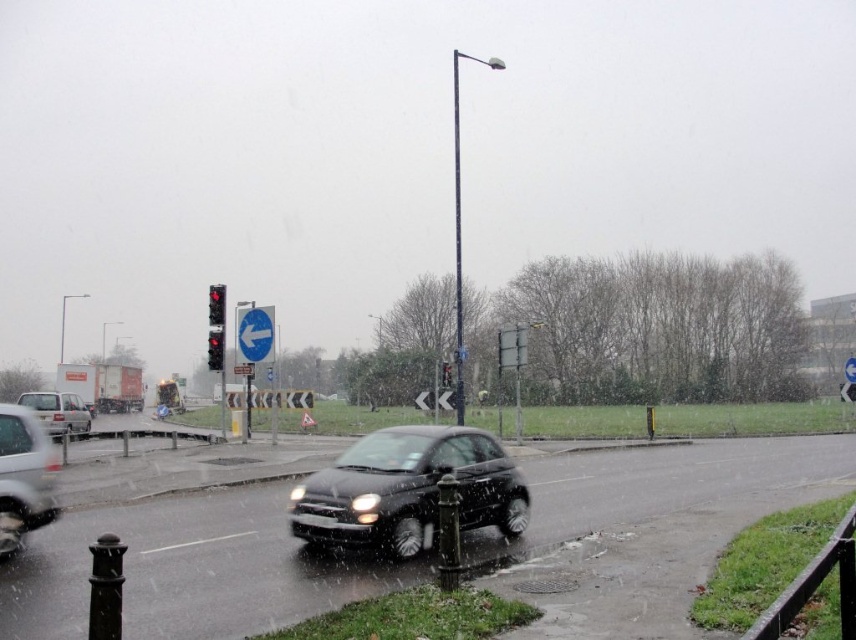
Question: Which of the following is the closest to the observer?

Choices:
 (A) (843, 374)
 (B) (10, 529)
 (C) (217, 340)
 (D) (295, 497)

Answer: (B)

Question: Which of these objects is positioned closest to the red glass traffic light at center?

Choices:
 (A) white plastic arrow at center
 (B) silver metallic van at left

Answer: (B)

Question: Is red glass traffic light at upper center smaller than white plastic arrow at center?

Choices:
 (A) yes
 (B) no

Answer: (A)

Question: Does glossy black car at center appear on the left side of red glass traffic light at upper center?

Choices:
 (A) no
 (B) yes

Answer: (A)

Question: Is white plastic sign at upper center positioned before white plastic arrow at center?

Choices:
 (A) yes
 (B) no

Answer: (A)

Question: Which point appears closest to the camera in this image?

Choices:
 (A) (432, 426)
 (B) (214, 346)

Answer: (A)